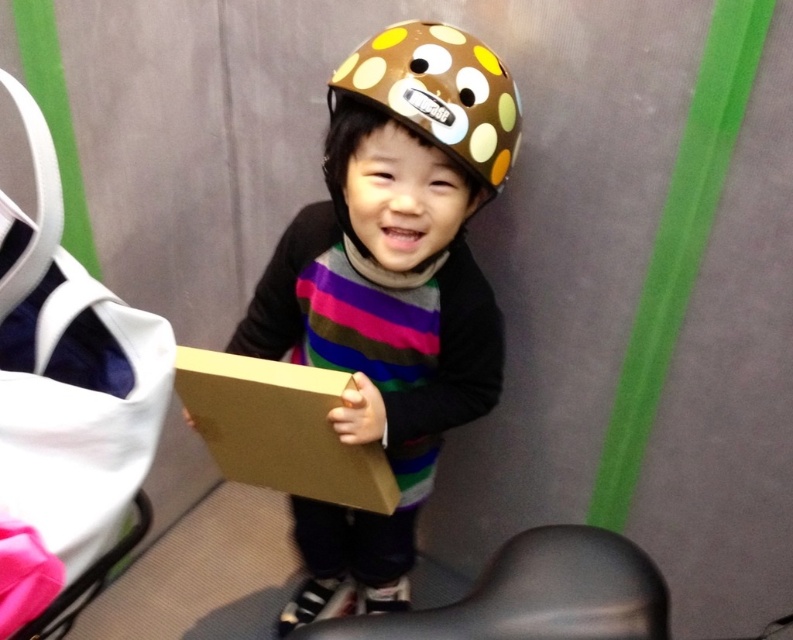
In the scene shown: Does brown dotted helmet at center have a lesser width compared to brown cardboard box at center?

Yes.

Measure the distance between point (366, 93) and camera.

Point (366, 93) and camera are 33.89 inches apart from each other.

This screenshot has width=793, height=640. Identify the location of brown dotted helmet at center. (428, 104).

Which of these two, brown matte helmet at center or brown cardboard box at center, stands shorter?

brown cardboard box at center

Does brown matte helmet at center have a lesser width compared to brown cardboard box at center?

In fact, brown matte helmet at center might be wider than brown cardboard box at center.

Is point (441, 312) less distant than point (311, 413)?

No, (441, 312) is behind (311, 413).

Image resolution: width=793 pixels, height=640 pixels. I want to click on brown matte helmet at center, so click(391, 291).

Can you confirm if brown matte helmet at center is positioned above brown dotted helmet at center?

No.

Describe the element at coordinates (391, 291) in the screenshot. I see `brown matte helmet at center` at that location.

Who is more distant from viewer, (404, 241) or (347, 68)?

Point (404, 241)

This screenshot has width=793, height=640. In order to click on brown matte helmet at center in this screenshot , I will do `click(391, 291)`.